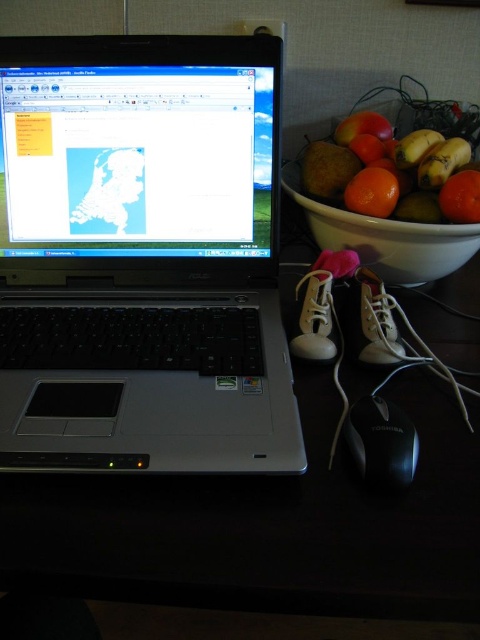
Question: Which of the following is the closest to the observer?

Choices:
 (A) silver/black plastic laptop at left
 (B) black plastic mouse at lower right
 (C) white glossy bowl at upper right
 (D) black plastic table at lower center

Answer: (D)

Question: Can you confirm if black plastic table at lower center is thinner than black plastic mouse at lower right?

Choices:
 (A) yes
 (B) no

Answer: (B)

Question: Among these points, which one is nearest to the camera?

Choices:
 (A) 439,268
 (B) 373,451

Answer: (B)

Question: Is silver/black plastic laptop at left to the left of white glossy bowl at upper right from the viewer's perspective?

Choices:
 (A) yes
 (B) no

Answer: (A)

Question: Is silver/black plastic laptop at left wider than shiny orange fruit at right?

Choices:
 (A) no
 (B) yes

Answer: (B)

Question: Which point is closer to the camera taking this photo?

Choices:
 (A) (388, 433)
 (B) (307, 209)
 (C) (348, 161)
 (D) (235, 138)

Answer: (A)